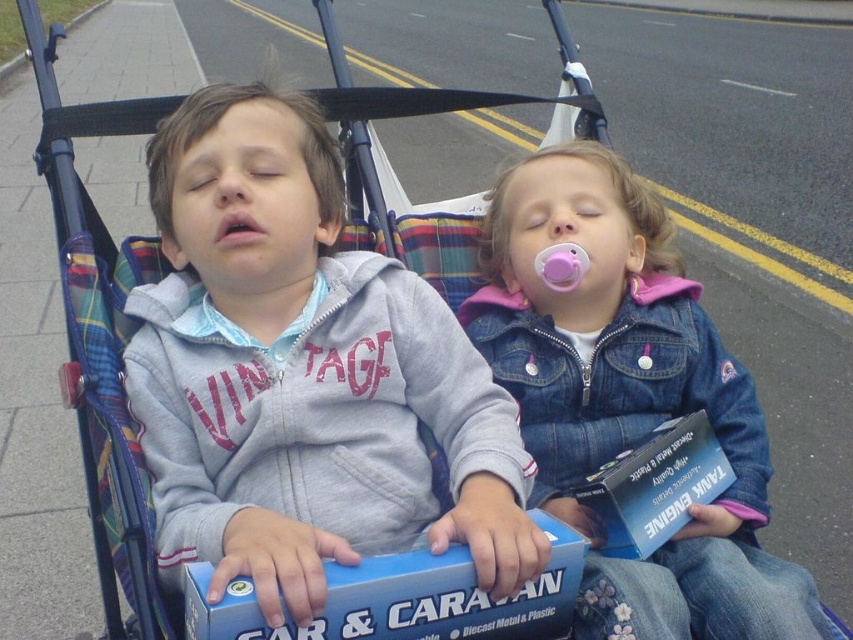
Who is taller, blue diecast metal & plastic car at center or blue diecast metal & plastic tank engine at center?

Standing taller between the two is blue diecast metal & plastic tank engine at center.

From the picture: Does blue diecast metal & plastic car at center appear over blue diecast metal & plastic tank engine at center?

Actually, blue diecast metal & plastic car at center is below blue diecast metal & plastic tank engine at center.

Is point (480, 627) more distant than point (601, 502)?

No, it is in front of (601, 502).

I want to click on blue diecast metal & plastic car at center, so click(404, 598).

Between matte gray hoodie at center and denim jacket at center, which one has less height?

matte gray hoodie at center

Who is positioned more to the left, matte gray hoodie at center or denim jacket at center?

Positioned to the left is matte gray hoodie at center.

Does point (387, 378) come behind point (653, 593)?

Yes, point (387, 378) is behind point (653, 593).

Find the location of a particular element. The image size is (853, 640). matte gray hoodie at center is located at coordinates (303, 372).

Who is more distant from viewer, (x=705, y=358) or (x=415, y=618)?

Positioned behind is point (x=705, y=358).

Is denim jacket at center to the right of blue diecast metal & plastic car at center from the viewer's perspective?

Correct, you'll find denim jacket at center to the right of blue diecast metal & plastic car at center.

This screenshot has width=853, height=640. I want to click on denim jacket at center, so click(x=630, y=397).